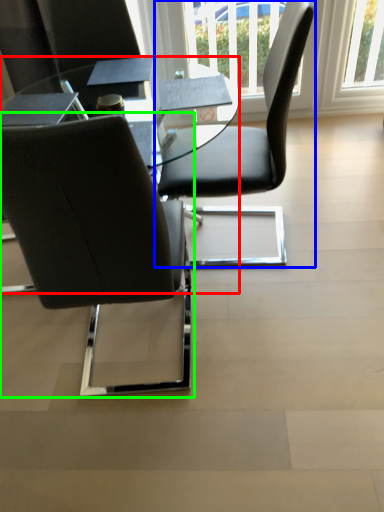
Question: Based on their relative distances, which object is nearer to table (highlighted by a red box)? Choose from chair (highlighted by a blue box) and chair (highlighted by a green box).

Choices:
 (A) chair
 (B) chair

Answer: (A)